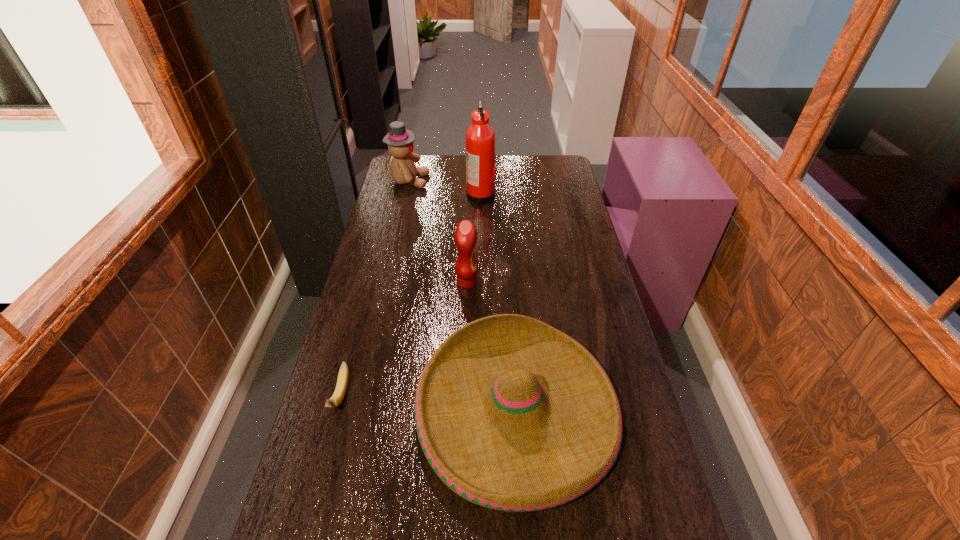
Locate an element on the screen. The height and width of the screenshot is (540, 960). vacant space at the far right corner of the desktop is located at coordinates (543, 168).

Where is `free space between the rag_doll and the tallest object`? Image resolution: width=960 pixels, height=540 pixels. free space between the rag_doll and the tallest object is located at coordinates (444, 188).

Locate an element on the screen. free point between the sombrero and the rag_doll is located at coordinates (463, 295).

Where is `unoccupied area between the shortest object and the rag_doll`? Image resolution: width=960 pixels, height=540 pixels. unoccupied area between the shortest object and the rag_doll is located at coordinates (374, 288).

Identify the location of vacant area between the rag_doll and the tallest object. (444, 188).

Locate an element on the screen. This screenshot has height=540, width=960. free space between the rag_doll and the third farthest object is located at coordinates (438, 232).

This screenshot has width=960, height=540. I want to click on free point between the banana and the rag_doll, so click(374, 288).

The width and height of the screenshot is (960, 540). Identify the location of object that stands as the second closest to the rag_doll. (465, 236).

Identify the location of object that ranks as the closest to the shortest object. (512, 414).

Identify the location of vacant region that satisfies the following two spatial constraints: 1. on the label side of the fire extinguisher; 2. at the stem of the banana. (481, 396).